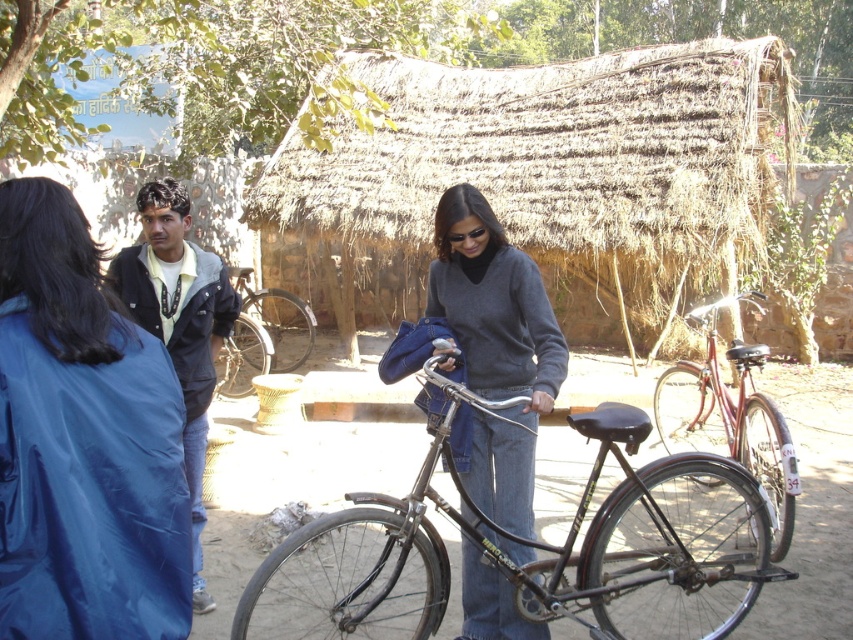
This screenshot has width=853, height=640. What are the coordinates of `thatched straw hut at center` in the screenshot? It's located at (555, 157).

In the scene shown: Is thatched straw hut at center above shiny metallic bicycle at center?

Indeed, thatched straw hut at center is positioned over shiny metallic bicycle at center.

Is point (453, 180) positioned after point (752, 470)?

Yes, point (453, 180) is behind point (752, 470).

I want to click on thatched straw hut at center, so click(x=555, y=157).

Who is more forward, (374, 198) or (3, 628)?

Positioned in front is point (3, 628).

Is point (282, 140) in front of point (13, 630)?

No.

This screenshot has width=853, height=640. Find the location of `thatched straw hut at center`. thatched straw hut at center is located at coordinates (555, 157).

Find the location of a particular element. The height and width of the screenshot is (640, 853). thatched straw hut at center is located at coordinates (555, 157).

Between thatched straw hut at center and black plastic goggles at center, which one appears on the right side from the viewer's perspective?

From the viewer's perspective, thatched straw hut at center appears more on the right side.

Is thatched straw hut at center bigger than black plastic goggles at center?

Yes, thatched straw hut at center is bigger than black plastic goggles at center.

Locate an element on the screen. This screenshot has width=853, height=640. thatched straw hut at center is located at coordinates (555, 157).